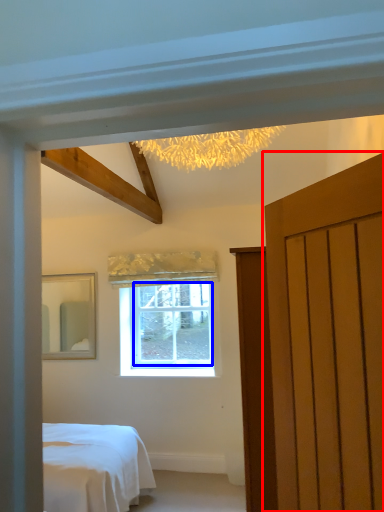
Question: Which object appears closest to the camera in this image, door (highlighted by a red box) or window screen (highlighted by a blue box)?

Choices:
 (A) door
 (B) window screen

Answer: (A)